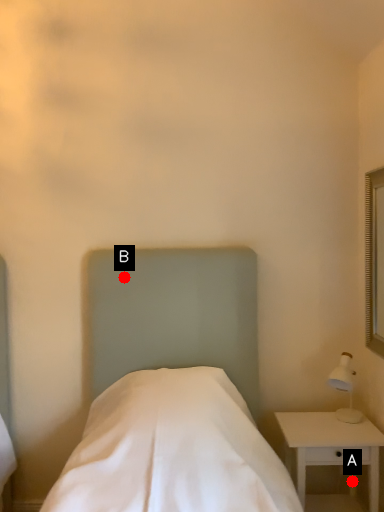
Question: Two points are circled on the image, labeled by A and B beside each circle. Which point appears closest to the camera in this image?

Choices:
 (A) A is closer
 (B) B is closer

Answer: (A)